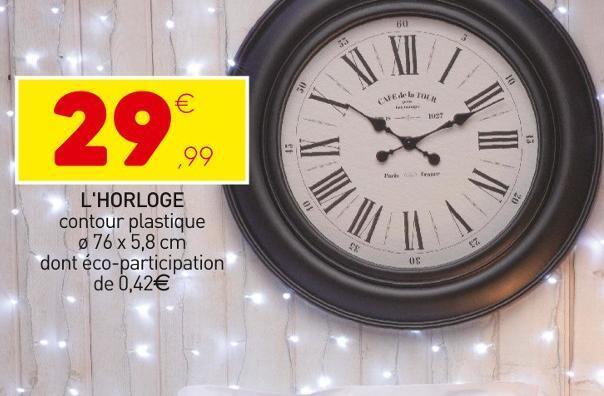
In order to click on wooden panelling in this screenshot , I will do `click(203, 323)`.